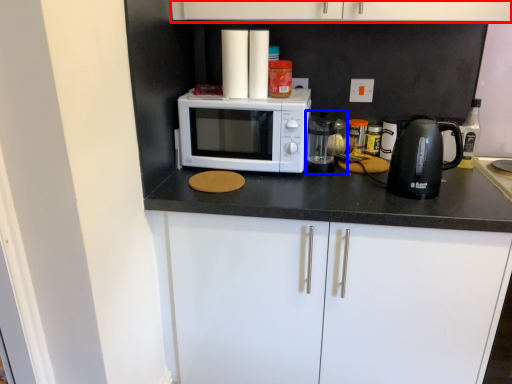
Question: Which of the following is the farthest to the observer, cabinetry (highlighted by a red box) or appliance (highlighted by a blue box)?

Choices:
 (A) cabinetry
 (B) appliance

Answer: (B)